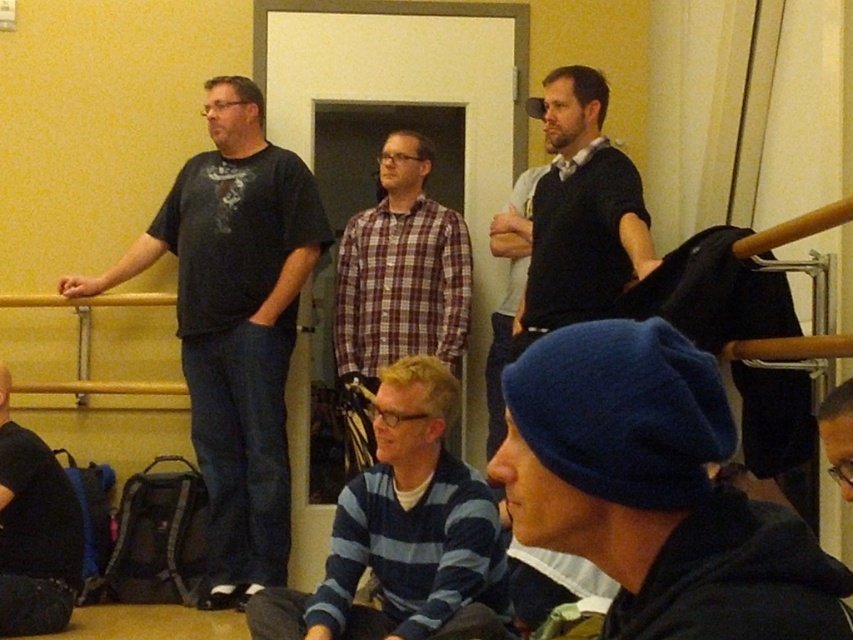
Question: Which point is closer to the camera?

Choices:
 (A) (194, 435)
 (B) (260, 624)
 (C) (413, 132)
 (D) (572, 108)

Answer: (B)

Question: Is blue striped sweater at center to the right of dark gray sweater at upper right from the viewer's perspective?

Choices:
 (A) no
 (B) yes

Answer: (A)

Question: Is the position of blue striped sweater at center less distant than that of blue knit cap at lower left?

Choices:
 (A) yes
 (B) no

Answer: (A)

Question: Does dark blue t-shirt at left appear under blue striped sweater at center?

Choices:
 (A) yes
 (B) no

Answer: (B)

Question: Which point is closer to the camera?

Choices:
 (A) dark blue t-shirt at left
 (B) plaid fabric shirt at center

Answer: (A)

Question: Which point is farther to the camera?

Choices:
 (A) 380,528
 (B) 62,532

Answer: (B)